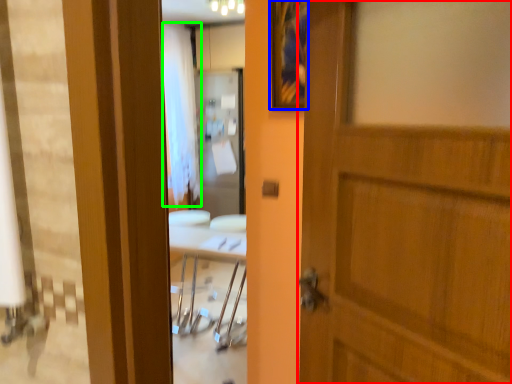
Question: Which is nearer to the door (highlighted by a red box)? picture frame (highlighted by a blue box) or curtain (highlighted by a green box).

Choices:
 (A) picture frame
 (B) curtain

Answer: (A)